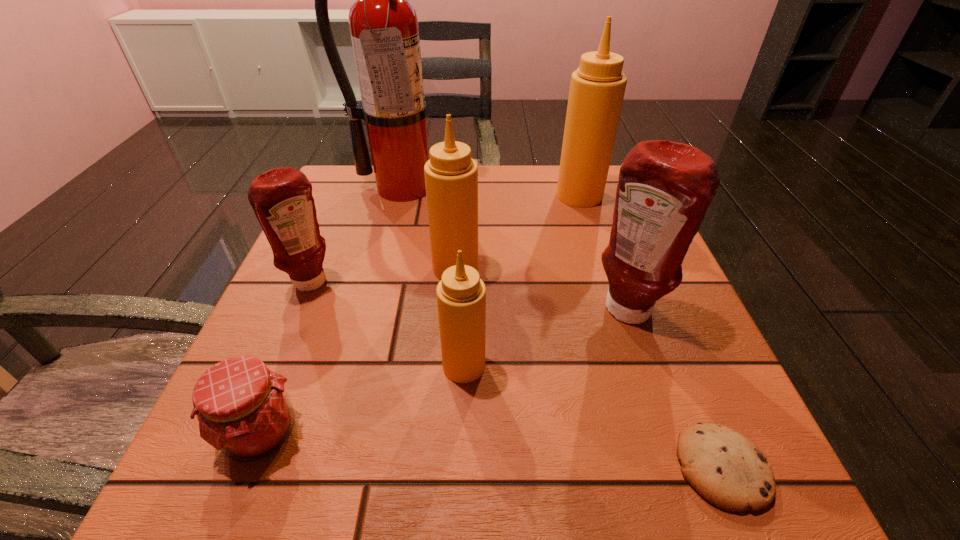
Find the location of a particular element. empty space between the smallest tan condiment and the leftmost condiment is located at coordinates (389, 325).

I want to click on vacant space that's between the cookie and the bigger red condiment, so click(x=675, y=390).

The width and height of the screenshot is (960, 540). I want to click on free point between the left red condiment and the shortest object, so click(517, 375).

I want to click on the seventh closest object to the seventh tallest object, so 597,88.

Identify the location of the closest object relative to the tallest object. Image resolution: width=960 pixels, height=540 pixels. (451, 176).

This screenshot has width=960, height=540. Find the location of `condiment that can be found as the fifth closest to the red jam`. condiment that can be found as the fifth closest to the red jam is located at coordinates (597, 88).

Identify which condiment is the second closest to the fire extinguisher. Please provide its 2D coordinates. Your answer should be formatted as a tuple, i.e. [(x, y)], where the tuple contains the x and y coordinates of a point satisfying the conditions above.

[(281, 198)]

The width and height of the screenshot is (960, 540). Find the location of `tan condiment object that ranks as the third closest to the cookie`. tan condiment object that ranks as the third closest to the cookie is located at coordinates (597, 88).

Identify which tan condiment is the second nearest to the leftmost condiment. Please provide its 2D coordinates. Your answer should be formatted as a tuple, i.e. [(x, y)], where the tuple contains the x and y coordinates of a point satisfying the conditions above.

[(461, 295)]

The width and height of the screenshot is (960, 540). I want to click on vacant space that satisfies the following two spatial constraints: 1. on the nozzle side of the farthest condiment; 2. on the left side of the red fire extinguisher, so click(400, 195).